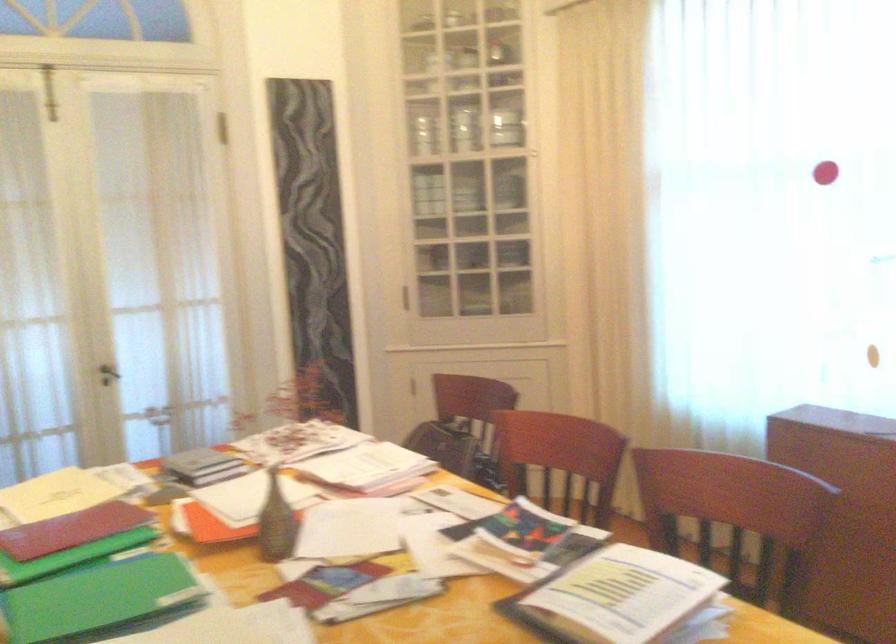
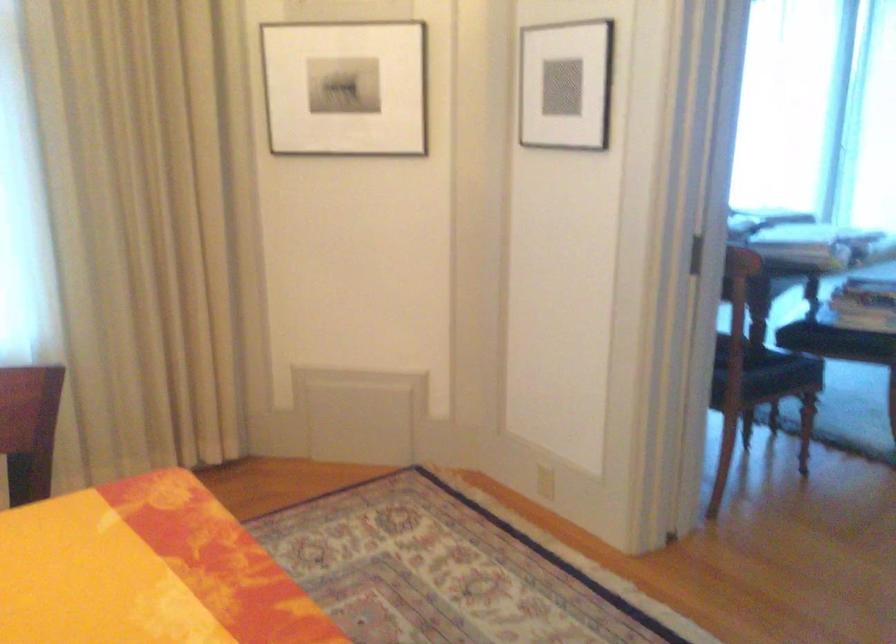
Question: The camera is either moving clockwise (left) or counter-clockwise (right) around the object. The first image is from the beginning of the video and the second image is from the end. Is the camera moving left or right when shooting the video?

Choices:
 (A) Left
 (B) Right

Answer: (A)